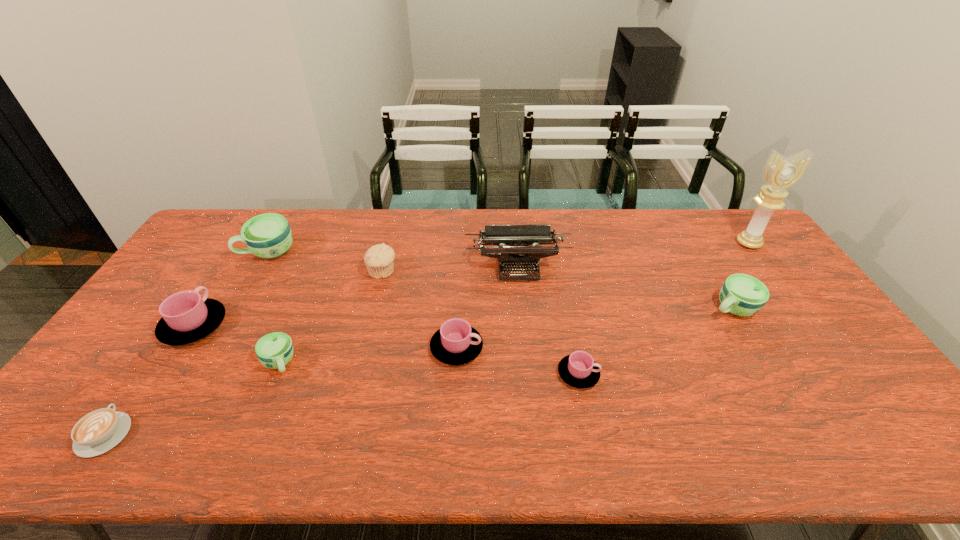
Locate an element on the screen. the tallest object is located at coordinates [780, 174].

You are a GUI agent. You are given a task and a screenshot of the screen. Output one action in this format:
    pyautogui.click(x=<x>, y=<y>)
    Task: Click on the award
    
    Given the screenshot: What is the action you would take?
    pyautogui.click(x=780, y=174)

Where is `typewriter`? The image size is (960, 540). typewriter is located at coordinates (519, 238).

Image resolution: width=960 pixels, height=540 pixels. I want to click on the biggest blue cup, so click(x=268, y=235).

The image size is (960, 540). Identify the location of the leftmost blue cup. (268, 235).

Find the location of a particular element. beige muffin is located at coordinates (379, 258).

At what (x,y) coordinates should I click in order to perform the action: click on muffin. Please return your answer as a coordinate pair (x, y). This screenshot has height=540, width=960. Looking at the image, I should click on (379, 258).

You are a GUI agent. You are given a task and a screenshot of the screen. Output one action in this format:
    pyautogui.click(x=<x>, y=<y>)
    Task: Click on the second biggest blue cup
    The image size is (960, 540).
    Given the screenshot: What is the action you would take?
    pyautogui.click(x=743, y=295)

Find the location of `the rightmost cup`. the rightmost cup is located at coordinates (743, 295).

Where is `the biggest pink cup`? the biggest pink cup is located at coordinates (186, 317).